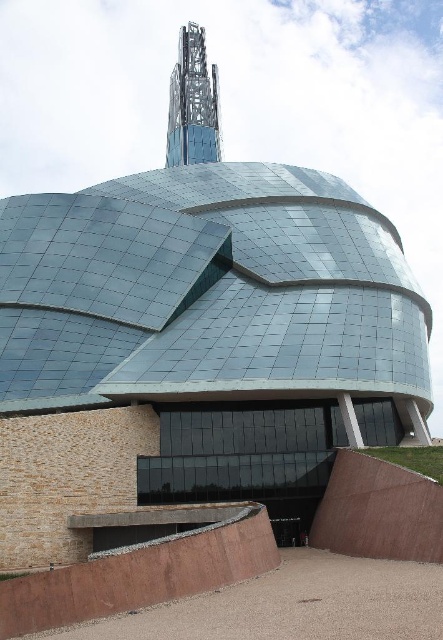
You are a delivery person trying to navigate a narrow cart through the area. You see the brown concrete ramp at lower center and the brown textured ramp at lower center. Which ramp should you choose to ensure your cart fits through?

The brown concrete ramp at lower center has a larger width than the brown textured ramp at lower center, so you should choose the brown concrete ramp at lower center to ensure your cart fits through.

You are an architect evaluating the structural integrity of the building. You notice the brown textured ramp at lower center and the glassy steel tower at upper center. Based on their positions, which object is more to the right side?

The brown textured ramp at lower center is positioned on the right side of the glassy steel tower at upper center, so it is more to the right side.

You are standing at the entrance of the modern architectural structure and want to locate the brown concrete ramp at lower center. According to the coordinates provided, where exactly should you look to find it?

The brown concrete ramp at lower center is located at the coordinates point (139, 577).